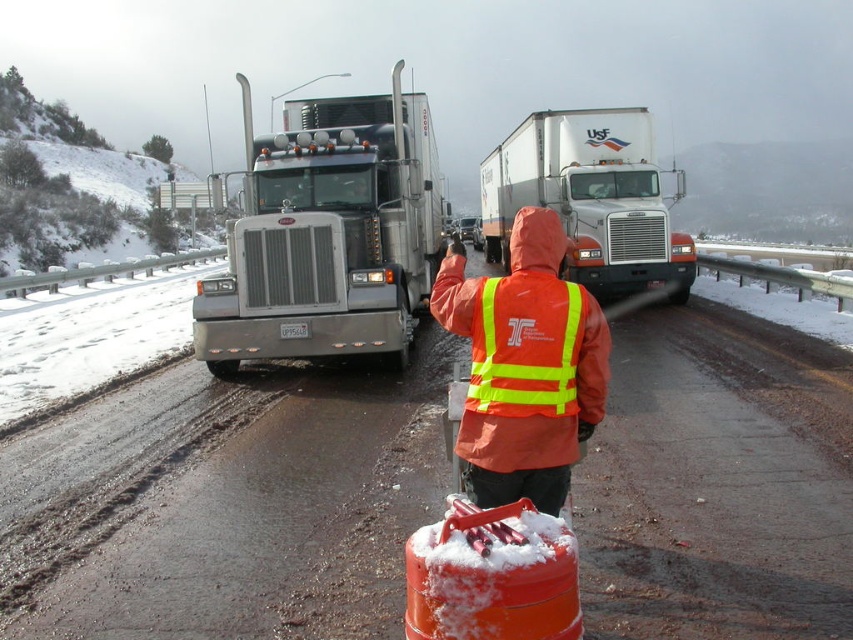
You are a driver approaching the icy road scene. You see two orange vests at the center. Which one is taller, the orange reflective vest at center or the orange reflective safety vest at center?

The orange reflective vest at center is taller than the orange reflective safety vest at center according to the description.

You are a pedestrian trying to cross the icy road safely. You see the orange reflective vest at center and the orange reflective safety vest at center. Which one is closer to you?

The orange reflective vest at center is closer to you because it is only 3.99 meters away from the orange reflective safety vest at center, but since both are at the same location, they are actually the same object. However, due to the duplication in labels, the question might be a trick question. Please check the scene description again for accuracy.